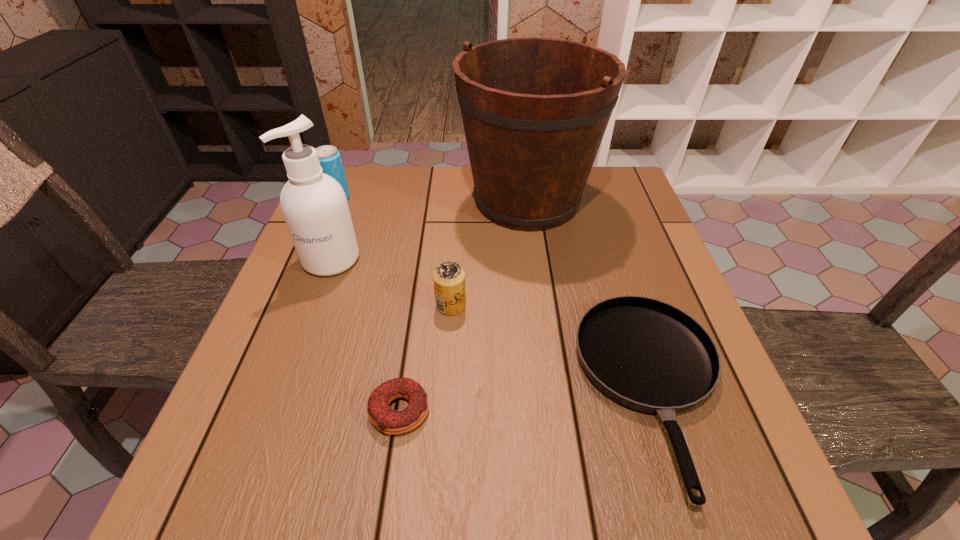
This screenshot has width=960, height=540. I want to click on vacant space that is in between the doughnut and the beer can, so click(425, 358).

This screenshot has width=960, height=540. I want to click on free space between the doughnut and the cleansing agent, so click(x=366, y=335).

Identify the location of vacant space in between the frying pan and the cleansing agent. The width and height of the screenshot is (960, 540). (492, 325).

Where is `free point between the fourth tallest object and the doughnut`? free point between the fourth tallest object and the doughnut is located at coordinates (425, 358).

Locate an element on the screen. The image size is (960, 540). free space between the cleansing agent and the doughnut is located at coordinates (366, 335).

You are a GUI agent. You are given a task and a screenshot of the screen. Output one action in this format:
    pyautogui.click(x=<x>, y=<y>)
    Task: Click on the vacant space that is in between the frying pan and the third shortest object
    The width and height of the screenshot is (960, 540).
    Given the screenshot: What is the action you would take?
    pyautogui.click(x=552, y=348)

Locate an element on the screen. Image resolution: width=960 pixels, height=540 pixels. free point between the doughnut and the fourth tallest object is located at coordinates (425, 358).

Select which object is the closest to the third tallest object. Please provide its 2D coordinates. Your answer should be formatted as a tuple, i.e. [(x, y)], where the tuple contains the x and y coordinates of a point satisfying the conditions above.

[(314, 206)]

Locate an element on the screen. The image size is (960, 540). object that can be found as the fifth closest to the cleansing agent is located at coordinates (x=648, y=355).

Locate an element on the screen. The width and height of the screenshot is (960, 540). vacant position in the image that satisfies the following two spatial constraints: 1. on the back side of the bucket; 2. on the left side of the doughnut is located at coordinates click(x=430, y=201).